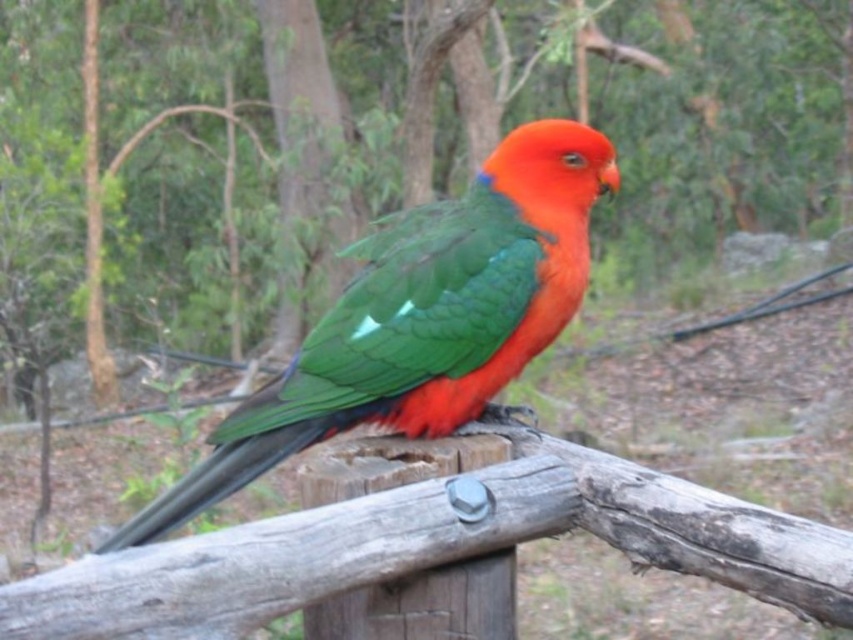
Question: Does wooden post at center appear on the left side of shiny green parrot at center?

Choices:
 (A) no
 (B) yes

Answer: (B)

Question: Is wooden post at center thinner than shiny green parrot at center?

Choices:
 (A) no
 (B) yes

Answer: (B)

Question: Is wooden post at center bigger than shiny green parrot at center?

Choices:
 (A) no
 (B) yes

Answer: (A)

Question: Which object appears farthest from the camera in this image?

Choices:
 (A) wooden post at center
 (B) shiny green parrot at center

Answer: (A)